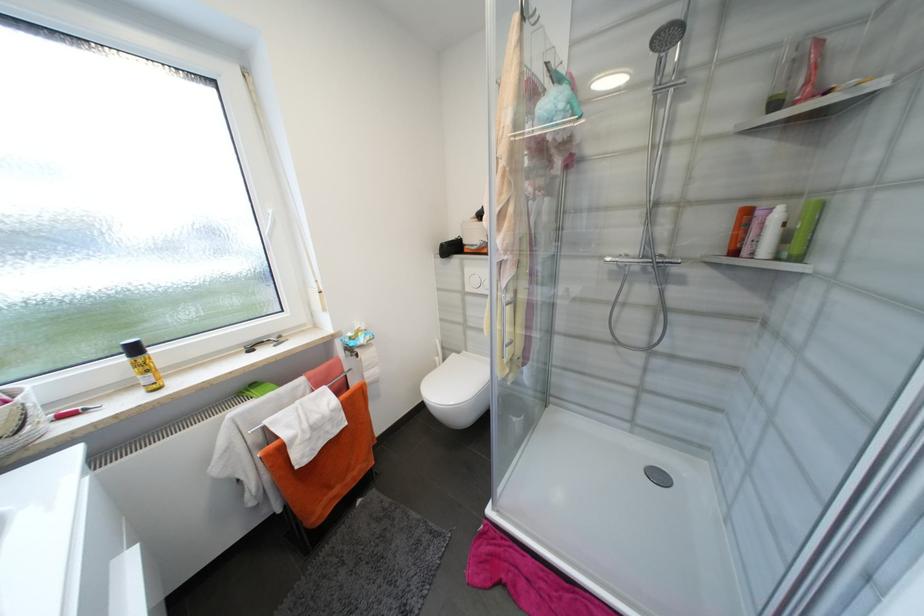
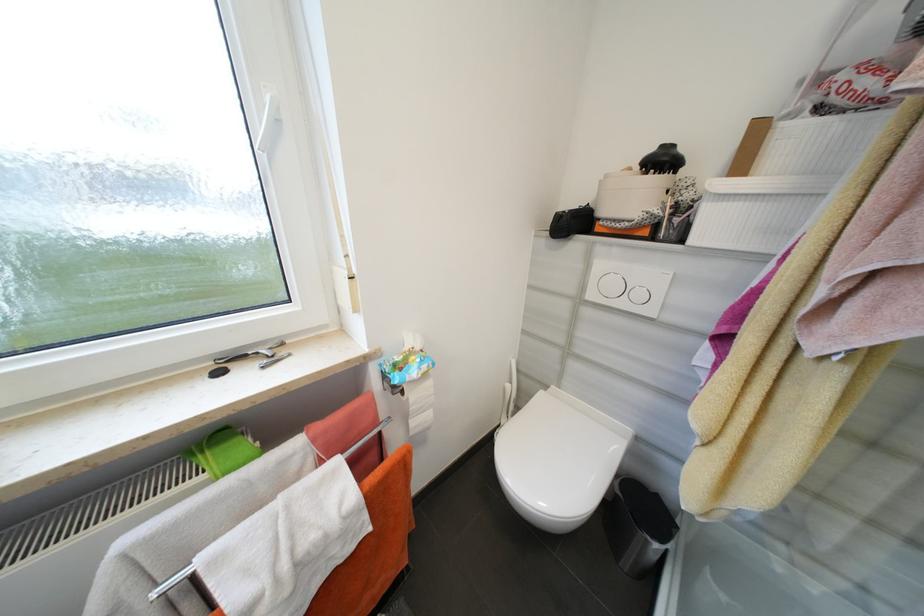
Locate, in the second image, the point that corresponds to (x=443, y=359) in the first image.

(514, 387)